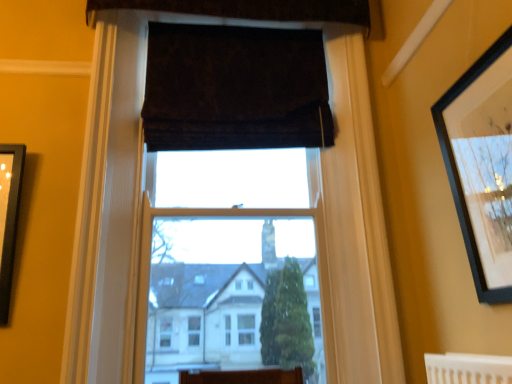
Find the location of a particular element. This screenshot has height=384, width=512. dark brown velvet curtain at upper center, which appears as the 1th curtain when viewed from the top is located at coordinates (261, 10).

Image resolution: width=512 pixels, height=384 pixels. I want to click on dark velvet curtain at upper center, which ranks as the 2th curtain in top-to-bottom order, so click(234, 88).

Locate an element on the screen. black matte picture frame at upper right is located at coordinates (490, 165).

The image size is (512, 384). In order to click on dark brown velvet curtain at upper center, which appears as the second curtain when ordered from the bottom in this screenshot , I will do `click(261, 10)`.

Does dark velvet curtain at upper center, the first curtain in the bottom-to-top sequence, turn towards dark brown velvet curtain at upper center, which appears as the 1th curtain when viewed from the top?

No, dark velvet curtain at upper center, the first curtain in the bottom-to-top sequence, is not facing towards dark brown velvet curtain at upper center, which appears as the 1th curtain when viewed from the top.

From a real-world perspective, is dark velvet curtain at upper center, the first curtain in the bottom-to-top sequence, positioned above or below dark brown velvet curtain at upper center, which appears as the 1th curtain when viewed from the top?

Clearly, from a real-world perspective, dark velvet curtain at upper center, the first curtain in the bottom-to-top sequence, is below dark brown velvet curtain at upper center, which appears as the 1th curtain when viewed from the top.

Identify the location of curtain on the left of dark velvet curtain at upper center, the first curtain in the bottom-to-top sequence. This screenshot has width=512, height=384. (261, 10).

Which object is further away from the camera, dark velvet curtain at upper center, which ranks as the 2th curtain in top-to-bottom order, or dark brown velvet curtain at upper center, which appears as the 1th curtain when viewed from the top?

dark brown velvet curtain at upper center, which appears as the 1th curtain when viewed from the top.

Does black matte picture frame at upper right turn towards dark velvet curtain at upper center, which ranks as the 2th curtain in top-to-bottom order?

No, black matte picture frame at upper right is not facing towards dark velvet curtain at upper center, which ranks as the 2th curtain in top-to-bottom order.

Considering the points (509, 302) and (207, 125), which point is in front, point (509, 302) or point (207, 125)?

The point (509, 302) is more forward.

Considering the positions of objects black matte picture frame at upper right and dark velvet curtain at upper center, which ranks as the 2th curtain in top-to-bottom order, in the image provided, who is in front, black matte picture frame at upper right or dark velvet curtain at upper center, which ranks as the 2th curtain in top-to-bottom order,?

black matte picture frame at upper right is in front.

From a real-world perspective, does black matte picture frame at upper right sit lower than dark velvet curtain at upper center, the first curtain in the bottom-to-top sequence?

Yes.

How distant is white wood window frame at center from dark velvet curtain at upper center, which ranks as the 2th curtain in top-to-bottom order?

white wood window frame at center is 65.54 centimeters from dark velvet curtain at upper center, which ranks as the 2th curtain in top-to-bottom order.

Considering the relative positions of white wood window frame at center and dark velvet curtain at upper center, which ranks as the 2th curtain in top-to-bottom order, in the image provided, is white wood window frame at center to the left of dark velvet curtain at upper center, which ranks as the 2th curtain in top-to-bottom order, from the viewer's perspective?

Indeed, white wood window frame at center is positioned on the left side of dark velvet curtain at upper center, which ranks as the 2th curtain in top-to-bottom order.

Is dark velvet curtain at upper center, the first curtain in the bottom-to-top sequence, at the back of white wood window frame at center?

Absolutely, white wood window frame at center is directed away from dark velvet curtain at upper center, the first curtain in the bottom-to-top sequence.

From the image's perspective, which one is positioned higher, white wood window frame at center or black matte picture frame at upper right?

black matte picture frame at upper right.

Considering the relative sizes of white wood window frame at center and black matte picture frame at upper right in the image provided, is white wood window frame at center smaller than black matte picture frame at upper right?

No, white wood window frame at center is not smaller than black matte picture frame at upper right.

From a real-world perspective, who is located lower, white wood window frame at center or black matte picture frame at upper right?

black matte picture frame at upper right is physically lower.

Does white wood window frame at center appear on the left side of black matte picture frame at upper right?

Correct, you'll find white wood window frame at center to the left of black matte picture frame at upper right.

Which of these two, white wood window frame at center or dark brown velvet curtain at upper center, which appears as the second curtain when ordered from the bottom, is bigger?

white wood window frame at center.

Does white wood window frame at center turn towards dark brown velvet curtain at upper center, which appears as the second curtain when ordered from the bottom?

Yes, white wood window frame at center is turned towards dark brown velvet curtain at upper center, which appears as the second curtain when ordered from the bottom.

From the image's perspective, is white wood window frame at center over dark brown velvet curtain at upper center, which appears as the 1th curtain when viewed from the top?

No, from the image's perspective, white wood window frame at center is not on top of dark brown velvet curtain at upper center, which appears as the 1th curtain when viewed from the top.

Is the position of white wood window frame at center less distant than that of dark brown velvet curtain at upper center, which appears as the 1th curtain when viewed from the top?

Yes, the depth of white wood window frame at center is less than that of dark brown velvet curtain at upper center, which appears as the 1th curtain when viewed from the top.

From the picture: Between dark brown velvet curtain at upper center, which appears as the second curtain when ordered from the bottom, and white wood window frame at center, which one appears on the left side from the viewer's perspective?

dark brown velvet curtain at upper center, which appears as the second curtain when ordered from the bottom, is more to the left.

Is dark brown velvet curtain at upper center, which appears as the second curtain when ordered from the bottom, in front of white wood window frame at center?

No, it is behind white wood window frame at center.

Consider the image. What's the angular difference between dark brown velvet curtain at upper center, which appears as the 1th curtain when viewed from the top, and white wood window frame at center's facing directions?

They differ by 0.000386 degrees in their facing directions.

From a real-world perspective, which is physically below, dark brown velvet curtain at upper center, which appears as the 1th curtain when viewed from the top, or white wood window frame at center?

white wood window frame at center is physically lower.

From a real-world perspective, between dark velvet curtain at upper center, the first curtain in the bottom-to-top sequence, and black matte picture frame at upper right, who is vertically lower?

From a 3D spatial view, black matte picture frame at upper right is below.

You are a GUI agent. You are given a task and a screenshot of the screen. Output one action in this format:
    pyautogui.click(x=<x>, y=<y>)
    Task: Click on the picture frame on the right of dark velvet curtain at upper center, which ranks as the 2th curtain in top-to-bottom order
    
    Given the screenshot: What is the action you would take?
    pyautogui.click(x=490, y=165)

From the picture: Considering the relative positions of dark velvet curtain at upper center, which ranks as the 2th curtain in top-to-bottom order, and black matte picture frame at upper right in the image provided, is dark velvet curtain at upper center, which ranks as the 2th curtain in top-to-bottom order, to the right of black matte picture frame at upper right from the viewer's perspective?

In fact, dark velvet curtain at upper center, which ranks as the 2th curtain in top-to-bottom order, is to the left of black matte picture frame at upper right.

Where is `curtain below the dark brown velvet curtain at upper center, which appears as the 1th curtain when viewed from the top (from a real-world perspective)`? curtain below the dark brown velvet curtain at upper center, which appears as the 1th curtain when viewed from the top (from a real-world perspective) is located at coordinates (234, 88).

Identify the location of curtain that is the 1st one when counting backward from the black matte picture frame at upper right. Image resolution: width=512 pixels, height=384 pixels. (234, 88).

From the image, which object appears to be nearer to dark velvet curtain at upper center, which ranks as the 2th curtain in top-to-bottom order, dark brown velvet curtain at upper center, which appears as the 1th curtain when viewed from the top, or white wood window frame at center?

Based on the image, dark brown velvet curtain at upper center, which appears as the 1th curtain when viewed from the top, appears to be nearer to dark velvet curtain at upper center, which ranks as the 2th curtain in top-to-bottom order.

From the image, which object appears to be nearer to black matte picture frame at upper right, dark velvet curtain at upper center, the first curtain in the bottom-to-top sequence, or dark brown velvet curtain at upper center, which appears as the second curtain when ordered from the bottom?

The object closer to black matte picture frame at upper right is dark velvet curtain at upper center, the first curtain in the bottom-to-top sequence.

Based on their spatial positions, is white wood window frame at center or dark velvet curtain at upper center, the first curtain in the bottom-to-top sequence, further from dark brown velvet curtain at upper center, which appears as the second curtain when ordered from the bottom?

white wood window frame at center.

Estimate the real-world distances between objects in this image. Which object is closer to white wood window frame at center, black matte picture frame at upper right or dark brown velvet curtain at upper center, which appears as the 1th curtain when viewed from the top?

black matte picture frame at upper right is closer to white wood window frame at center.

Looking at the image, which one is located closer to black matte picture frame at upper right, dark brown velvet curtain at upper center, which appears as the 1th curtain when viewed from the top, or dark velvet curtain at upper center, the first curtain in the bottom-to-top sequence?

dark velvet curtain at upper center, the first curtain in the bottom-to-top sequence, is closer to black matte picture frame at upper right.

From the image, which object appears to be nearer to dark brown velvet curtain at upper center, which appears as the 1th curtain when viewed from the top, dark velvet curtain at upper center, which ranks as the 2th curtain in top-to-bottom order, or black matte picture frame at upper right?

Based on the image, dark velvet curtain at upper center, which ranks as the 2th curtain in top-to-bottom order, appears to be nearer to dark brown velvet curtain at upper center, which appears as the 1th curtain when viewed from the top.

Which object lies further to the anchor point dark brown velvet curtain at upper center, which appears as the 1th curtain when viewed from the top, white wood window frame at center or black matte picture frame at upper right?

white wood window frame at center is further to dark brown velvet curtain at upper center, which appears as the 1th curtain when viewed from the top.

When comparing their distances from black matte picture frame at upper right, does white wood window frame at center or dark brown velvet curtain at upper center, which appears as the second curtain when ordered from the bottom, seem further?

dark brown velvet curtain at upper center, which appears as the second curtain when ordered from the bottom, is positioned further to the anchor black matte picture frame at upper right.

You are a GUI agent. You are given a task and a screenshot of the screen. Output one action in this format:
    pyautogui.click(x=<x>, y=<y>)
    Task: Click on the curtain located between black matte picture frame at upper right and dark brown velvet curtain at upper center, which appears as the 1th curtain when viewed from the top, in the depth direction
    The height and width of the screenshot is (384, 512).
    Given the screenshot: What is the action you would take?
    (234, 88)

The height and width of the screenshot is (384, 512). I want to click on picture frame between dark brown velvet curtain at upper center, which appears as the 1th curtain when viewed from the top, and white wood window frame at center in the up-down direction, so click(x=490, y=165).

At what (x,y) coordinates should I click in order to perform the action: click on curtain between dark brown velvet curtain at upper center, which appears as the 1th curtain when viewed from the top, and white wood window frame at center, in the vertical direction. Please return your answer as a coordinate pair (x, y). The width and height of the screenshot is (512, 384). Looking at the image, I should click on [x=234, y=88].

I want to click on window frame between black matte picture frame at upper right and dark velvet curtain at upper center, which ranks as the 2th curtain in top-to-bottom order, from front to back, so click(x=183, y=280).